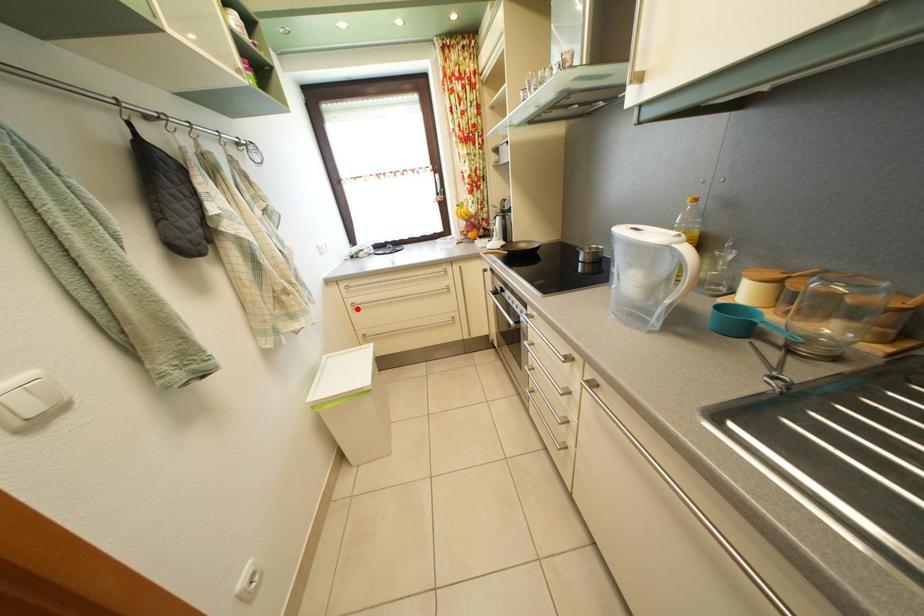
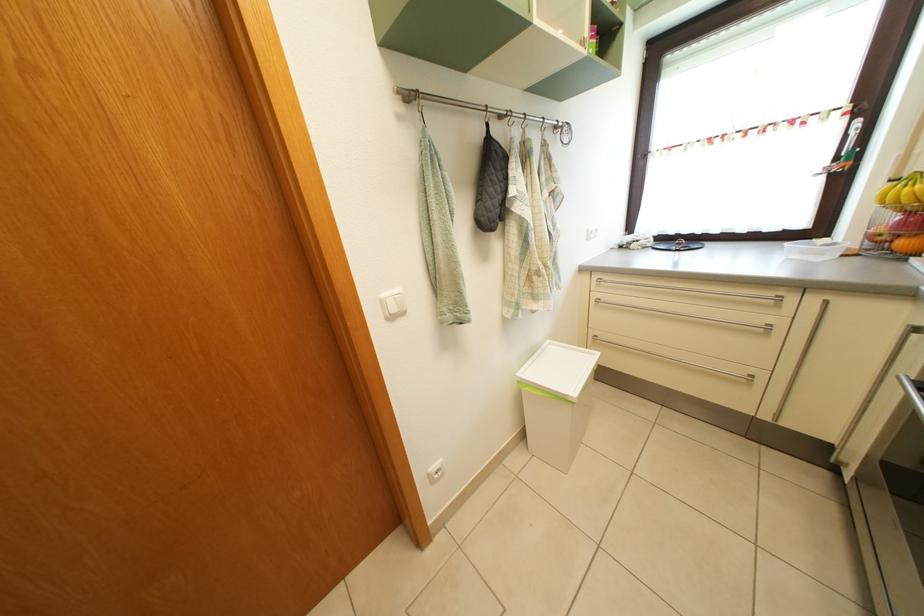
Question: I am providing you with two images of the same scene from different viewpoints. Given a red point in image1, look at the same physical point in image2. Is it:

Choices:
 (A) Closer to the viewpoint
 (B) Farther from the viewpoint

Answer: (B)